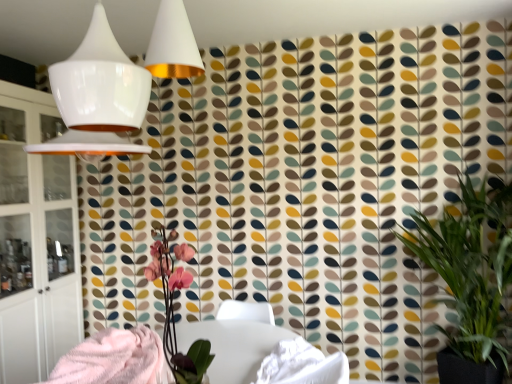
Question: Is white glossy table at center taller than white glossy lampshade at upper left?

Choices:
 (A) no
 (B) yes

Answer: (A)

Question: Is white glossy table at center thinner than white glossy lampshade at upper left?

Choices:
 (A) no
 (B) yes

Answer: (B)

Question: Considering the relative sizes of white glossy table at center and white glossy lampshade at upper left in the image provided, is white glossy table at center wider than white glossy lampshade at upper left?

Choices:
 (A) no
 (B) yes

Answer: (A)

Question: Does white glossy table at center appear on the right side of white glossy lampshade at upper left?

Choices:
 (A) yes
 (B) no

Answer: (A)

Question: From the image's perspective, is white glossy table at center under white glossy lampshade at upper left?

Choices:
 (A) yes
 (B) no

Answer: (A)

Question: Is white glossy table at center outside white glossy lampshade at upper left?

Choices:
 (A) yes
 (B) no

Answer: (A)

Question: Considering the relative sizes of white glossy lampshade at upper left and fluffy pink blanket at lower left in the image provided, is white glossy lampshade at upper left shorter than fluffy pink blanket at lower left?

Choices:
 (A) no
 (B) yes

Answer: (A)

Question: From a real-world perspective, is white glossy lampshade at upper left beneath fluffy pink blanket at lower left?

Choices:
 (A) yes
 (B) no

Answer: (B)

Question: From the image's perspective, does white glossy lampshade at upper left appear higher than fluffy pink blanket at lower left?

Choices:
 (A) no
 (B) yes

Answer: (B)

Question: Is white glossy lampshade at upper left directly adjacent to fluffy pink blanket at lower left?

Choices:
 (A) yes
 (B) no

Answer: (B)

Question: Does white glossy lampshade at upper left have a smaller size compared to fluffy pink blanket at lower left?

Choices:
 (A) no
 (B) yes

Answer: (A)

Question: Is fluffy pink blanket at lower left at the back of white glossy lampshade at upper left?

Choices:
 (A) yes
 (B) no

Answer: (B)

Question: From the image's perspective, is fluffy pink blanket at lower left on top of white glass cabinet at left?

Choices:
 (A) no
 (B) yes

Answer: (A)